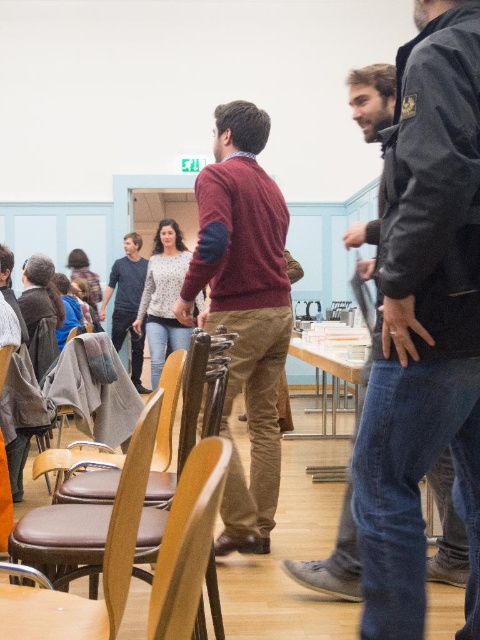
Between brown leather chair at lower left and wooden table at center, which one has less height?

wooden table at center

Can you confirm if brown leather chair at lower left is positioned to the left of wooden table at center?

Indeed, brown leather chair at lower left is positioned on the left side of wooden table at center.

Between point (145, 428) and point (324, 420), which one is positioned behind?

Point (324, 420)

Locate an element on the screen. The width and height of the screenshot is (480, 640). brown leather chair at lower left is located at coordinates (100, 563).

Does point (228, 515) lie behind point (168, 257)?

That is False.

Does maroon sweater at center appear on the right side of speckled sweater at center?

Yes, maroon sweater at center is to the right of speckled sweater at center.

Does point (204, 196) come in front of point (159, 269)?

Yes, it is in front of point (159, 269).

Where is `maroon sweater at center`? The height and width of the screenshot is (640, 480). maroon sweater at center is located at coordinates [243, 308].

Describe the element at coordinates (243, 308) in the screenshot. I see `maroon sweater at center` at that location.

Looking at this image, is maroon sweater at center positioned in front of brown leather chair at lower left?

That is False.

Is point (239, 342) behind point (132, 531)?

Yes, it is.

The image size is (480, 640). Identify the location of maroon sweater at center. (243, 308).